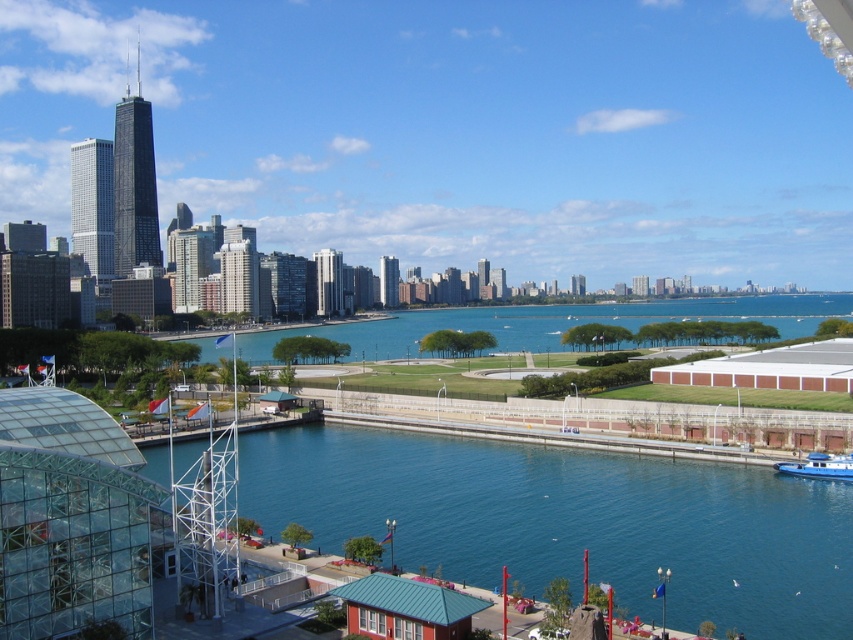
Question: In this image, where is blue water at center located relative to blue matte boat at lower right?

Choices:
 (A) above
 (B) below

Answer: (A)

Question: Is blue water at center smaller than blue matte boat at lower right?

Choices:
 (A) no
 (B) yes

Answer: (A)

Question: Among these points, which one is farthest from the camera?

Choices:
 (A) (813, 474)
 (B) (288, 445)
 (C) (682, 342)

Answer: (C)

Question: Can you confirm if blue glassy water at lower center is positioned below blue water at center?

Choices:
 (A) no
 (B) yes

Answer: (B)

Question: Which of the following is the farthest from the observer?

Choices:
 (A) blue water at center
 (B) blue matte boat at lower right

Answer: (B)

Question: Which of these objects is positioned closest to the blue water at center?

Choices:
 (A) blue matte boat at lower right
 (B) blue glassy water at lower center

Answer: (B)